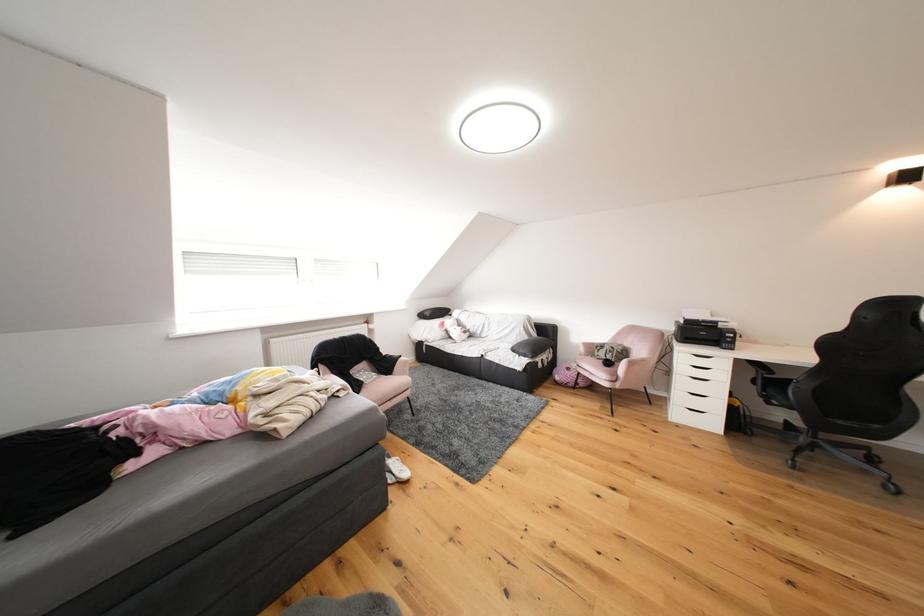
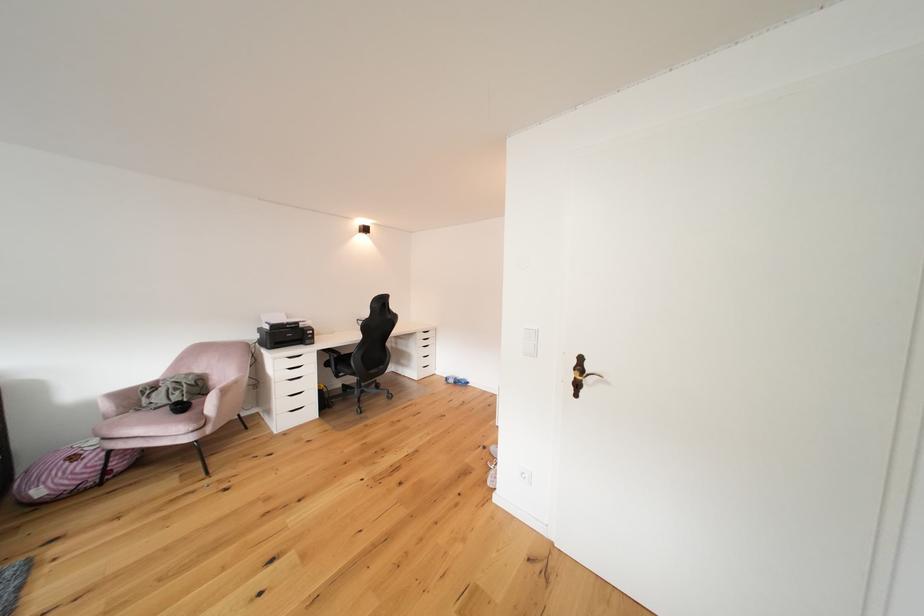
Find the pixel in the second image that matches point (706, 407) in the first image.

(306, 406)